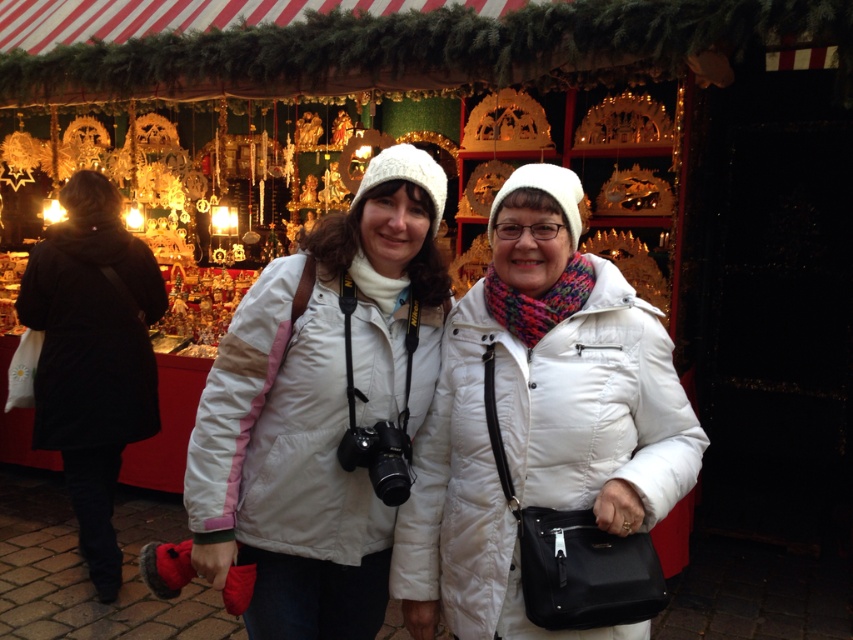
Question: Among these objects, which one is nearest to the camera?

Choices:
 (A) black matte coat at left
 (B) white puffy jacket at center

Answer: (B)

Question: Does white matte jacket at center appear on the left side of black matte coat at left?

Choices:
 (A) no
 (B) yes

Answer: (A)

Question: Which point is farther from the camera taking this photo?

Choices:
 (A) (372, 419)
 (B) (498, 608)

Answer: (A)

Question: Does white puffy jacket at center have a larger size compared to white matte jacket at center?

Choices:
 (A) yes
 (B) no

Answer: (A)

Question: Is white matte jacket at center positioned behind black matte coat at left?

Choices:
 (A) yes
 (B) no

Answer: (B)

Question: Which of the following is the closest to the observer?

Choices:
 (A) white matte jacket at center
 (B) white puffy jacket at center

Answer: (B)